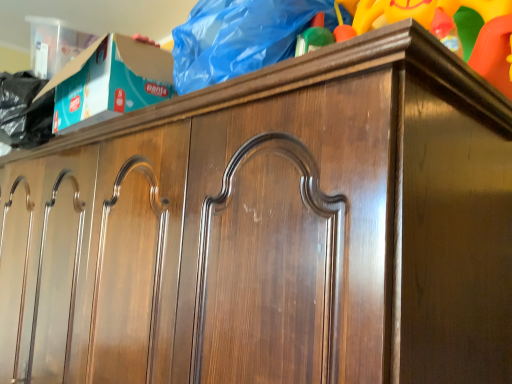
Describe the element at coordinates (446, 29) in the screenshot. Image resolution: width=512 pixels, height=384 pixels. I see `wooden toy at upper right` at that location.

Where is `wooden toy at upper right`? The image size is (512, 384). wooden toy at upper right is located at coordinates (446, 29).

Measure the distance between wooden toy at upper right and camera.

The distance of wooden toy at upper right from camera is 29.25 inches.

Locate an element on the screen. The image size is (512, 384). wooden cabinet at upper center is located at coordinates (239, 38).

This screenshot has width=512, height=384. Describe the element at coordinates (239, 38) in the screenshot. I see `wooden cabinet at upper center` at that location.

Locate an element on the screen. The image size is (512, 384). wooden toy at upper right is located at coordinates (446, 29).

Considering the positions of objects wooden cabinet at upper center and wooden toy at upper right in the image provided, who is more to the right, wooden cabinet at upper center or wooden toy at upper right?

From the viewer's perspective, wooden toy at upper right appears more on the right side.

Considering the positions of objects wooden cabinet at upper center and wooden toy at upper right in the image provided, who is in front, wooden cabinet at upper center or wooden toy at upper right?

wooden toy at upper right is closer to the camera.

Which point is more distant from viewer, (266, 41) or (370, 20)?

The point (370, 20) is behind.

From the image's perspective, which one is positioned lower, wooden cabinet at upper center or wooden toy at upper right?

wooden cabinet at upper center.

From a real-world perspective, is wooden cabinet at upper center on top of wooden toy at upper right?

No, from a real-world perspective, wooden cabinet at upper center is not above wooden toy at upper right.

Which object is thinner, wooden cabinet at upper center or wooden toy at upper right?

Thinner between the two is wooden toy at upper right.

Who is shorter, wooden cabinet at upper center or wooden toy at upper right?

Standing shorter between the two is wooden cabinet at upper center.

Considering the sizes of objects wooden cabinet at upper center and wooden toy at upper right in the image provided, who is bigger, wooden cabinet at upper center or wooden toy at upper right?

wooden cabinet at upper center is bigger.

In the scene shown: Would you say wooden cabinet at upper center is inside or outside wooden toy at upper right?

wooden cabinet at upper center exists outside the volume of wooden toy at upper right.

Is wooden cabinet at upper center with wooden toy at upper right?

No, wooden cabinet at upper center is not beside wooden toy at upper right.

Is wooden toy at upper right at the back of wooden cabinet at upper center?

No.

Identify the location of toy located above the wooden cabinet at upper center (from the image's perspective). (446, 29).

Considering the relative positions of wooden toy at upper right and wooden cabinet at upper center in the image provided, is wooden toy at upper right to the left or to the right of wooden cabinet at upper center?

wooden toy at upper right is positioned on wooden cabinet at upper center's right side.

Considering the relative positions of wooden toy at upper right and wooden cabinet at upper center in the image provided, is wooden toy at upper right behind wooden cabinet at upper center?

No.

Does point (423, 7) appear closer or farther from the camera than point (217, 52)?

Point (423, 7) appears to be closer to the viewer than point (217, 52).

From the image's perspective, is wooden toy at upper right above or below wooden cabinet at upper center?

wooden toy at upper right is above wooden cabinet at upper center.

From a real-world perspective, which is physically below, wooden toy at upper right or wooden cabinet at upper center?

wooden cabinet at upper center is physically lower.

Considering the sizes of wooden toy at upper right and wooden cabinet at upper center in the image, is wooden toy at upper right wider or thinner than wooden cabinet at upper center?

wooden toy at upper right is thinner than wooden cabinet at upper center.

Is wooden toy at upper right taller or shorter than wooden cabinet at upper center?

In the image, wooden toy at upper right appears to be taller than wooden cabinet at upper center.

Is wooden toy at upper right smaller than wooden cabinet at upper center?

Indeed, wooden toy at upper right has a smaller size compared to wooden cabinet at upper center.

Which is correct: wooden toy at upper right is inside wooden cabinet at upper center, or outside of it?

wooden toy at upper right is outside wooden cabinet at upper center.

Is wooden toy at upper right touching wooden cabinet at upper center?

No, wooden toy at upper right is not with wooden cabinet at upper center.

Could you tell me if wooden toy at upper right is turned towards wooden cabinet at upper center?

No, wooden toy at upper right is not oriented towards wooden cabinet at upper center.

How different are the orientations of wooden toy at upper right and wooden cabinet at upper center in degrees?

4.45e-05 degrees separate the facing orientations of wooden toy at upper right and wooden cabinet at upper center.

Locate an element on the screen. The width and height of the screenshot is (512, 384). toy above the wooden cabinet at upper center (from the image's perspective) is located at coordinates (446, 29).

At what (x,y) coordinates should I click in order to perform the action: click on toy above the wooden cabinet at upper center (from the image's perspective). Please return your answer as a coordinate pair (x, y). This screenshot has width=512, height=384. Looking at the image, I should click on (446, 29).

Where is `material that appears on the left of wooden toy at upper right`? The height and width of the screenshot is (384, 512). material that appears on the left of wooden toy at upper right is located at coordinates (239, 38).